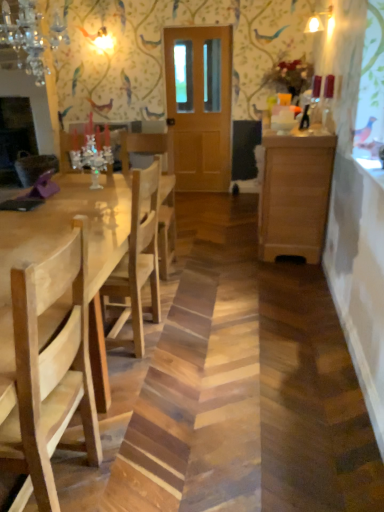
This screenshot has width=384, height=512. Find the location of `free point below crystal glass chandelier at upper left (from a real-world perspective)`. free point below crystal glass chandelier at upper left (from a real-world perspective) is located at coordinates (43, 215).